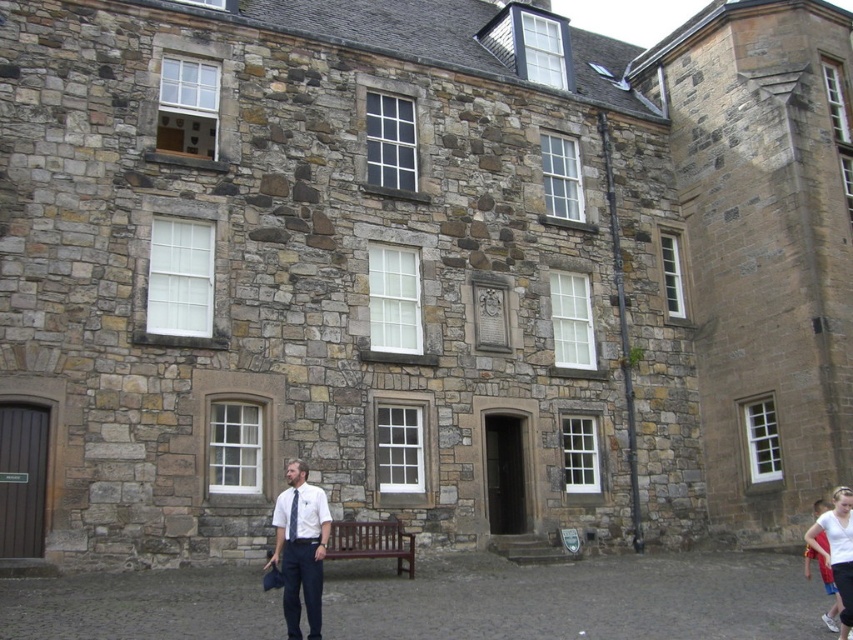
Which of these two, white shirt at center or blue silk tie at center, stands shorter?

Standing shorter between the two is blue silk tie at center.

Does white shirt at center appear over blue silk tie at center?

Incorrect, white shirt at center is not positioned above blue silk tie at center.

Is point (316, 572) farther from viewer compared to point (294, 492)?

No, (316, 572) is in front of (294, 492).

I want to click on white shirt at center, so click(300, 548).

From the picture: Does white shirt at center lie in front of white cotton t-shirt at lower right?

Yes.

Between white shirt at center and white cotton t-shirt at lower right, which one is positioned higher?

white shirt at center is above.

Does point (294, 589) come closer to viewer compared to point (837, 566)?

Yes, it is.

Find the location of `white shirt at center`. white shirt at center is located at coordinates coord(300,548).

Is white cotton t-shirt at lower right bigger than blue silk tie at center?

Indeed, white cotton t-shirt at lower right has a larger size compared to blue silk tie at center.

Can you confirm if white cotton t-shirt at lower right is shorter than blue silk tie at center?

In fact, white cotton t-shirt at lower right may be taller than blue silk tie at center.

Who is more forward, [834,556] or [289,529]?

Point [834,556]

Locate an element on the screen. white cotton t-shirt at lower right is located at coordinates (837, 548).